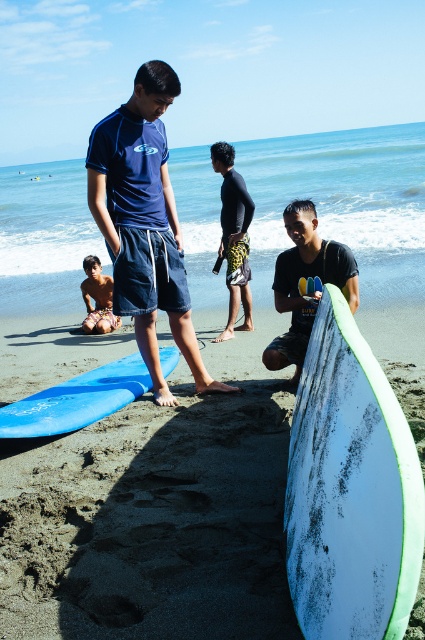
Question: Which point appears farthest from the camera in this image?

Choices:
 (A) (317, 237)
 (B) (119, 600)
 (C) (132, 380)
 (D) (226, 154)

Answer: (D)

Question: Estimate the real-world distances between objects in this image. Which object is closer to the white matte surfboard at lower right?

Choices:
 (A) shiny skin body at lower left
 (B) matte blue shorts at center

Answer: (B)

Question: Which object is farther from the camera taking this photo?

Choices:
 (A) white matte surfboard at lower right
 (B) blue matte surfboard at lower left
 (C) matte blue shorts at center

Answer: (B)

Question: Is the position of white matte surfboard at center less distant than that of matte blue shorts at center?

Choices:
 (A) no
 (B) yes

Answer: (B)

Question: Is matte blue shorts at center positioned behind blue matte surfboard at lower left?

Choices:
 (A) no
 (B) yes

Answer: (A)

Question: From the image, what is the correct spatial relationship of white matte surfboard at lower right in relation to matte blue shorts at center?

Choices:
 (A) below
 (B) above

Answer: (A)